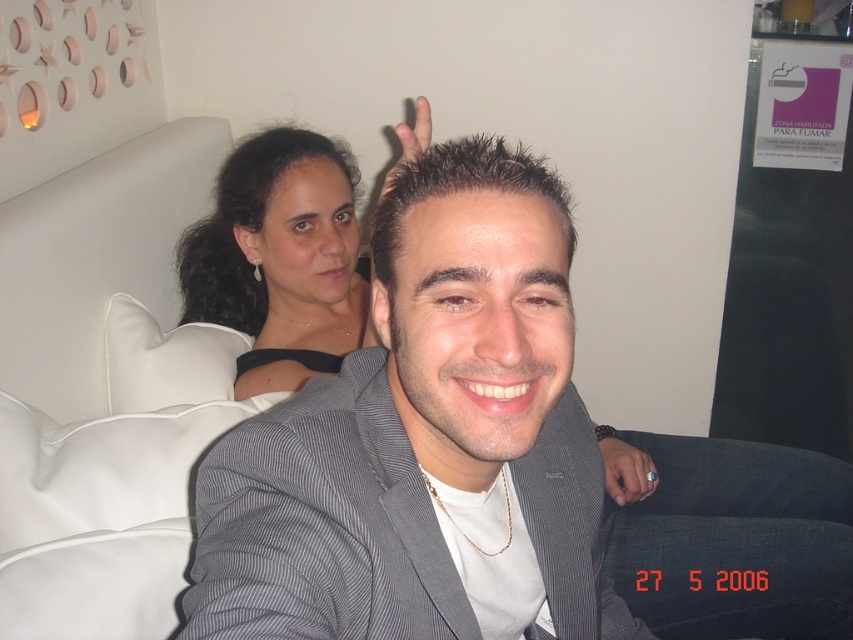
Which is behind, point (637, 467) or point (416, 131)?

The point (637, 467) is behind.

Does gold ring at center appear over matte black hand at upper center?

No, gold ring at center is not above matte black hand at upper center.

Find the location of a particular element. Image resolution: width=853 pixels, height=640 pixels. gold ring at center is located at coordinates (625, 472).

Does point (180, 369) come behind point (618, 451)?

No, (180, 369) is closer to viewer.

Locate an element on the screen. The image size is (853, 640). white fabric pillow at upper left is located at coordinates (165, 358).

Where is `matte black dress at upper left`? The height and width of the screenshot is (640, 853). matte black dress at upper left is located at coordinates (279, 259).

Measure the distance between point (308,376) and camera.

The distance of point (308,376) from camera is 1.21 meters.

Is point (254, 356) positioned before point (645, 458)?

Yes.

Find the location of a particular element. matte black dress at upper left is located at coordinates (279, 259).